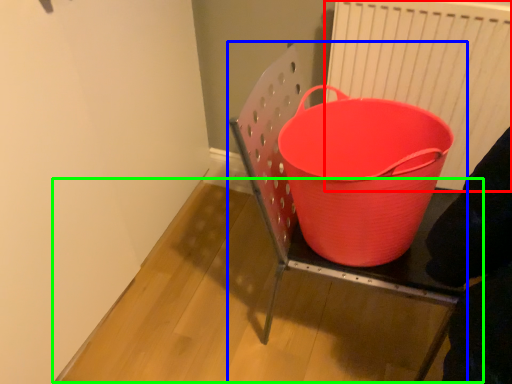
Question: Based on their relative distances, which object is nearer to radiator (highlighted by a red box)? Choose from furniture (highlighted by a blue box) and table (highlighted by a green box).

Choices:
 (A) furniture
 (B) table

Answer: (A)